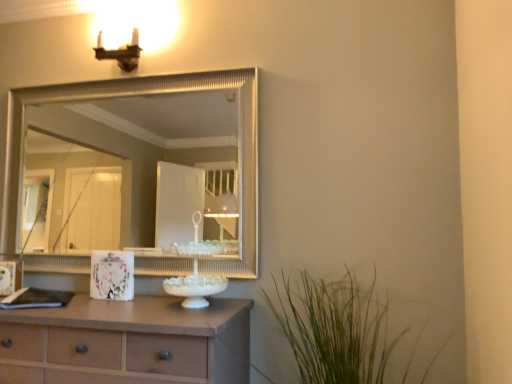
This screenshot has width=512, height=384. I want to click on vacant area situated to the left side of white glossy picture frame at center, so click(x=82, y=301).